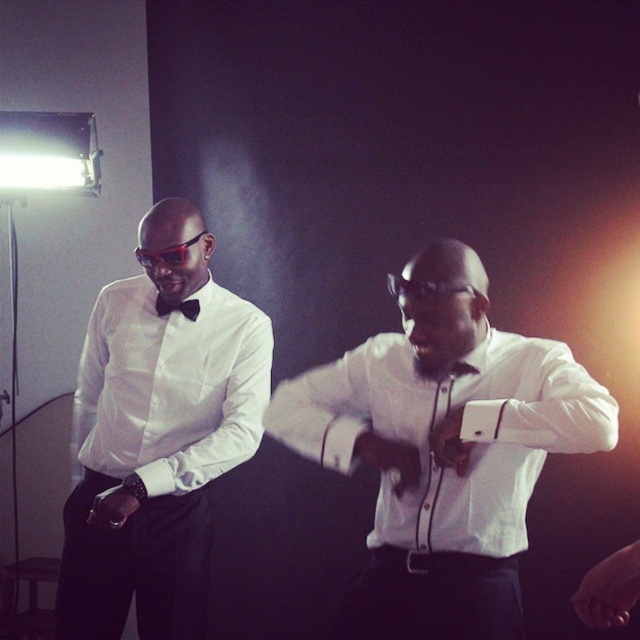
Can you confirm if white satin shirt at center is positioned to the right of white satin shirt at left?

Yes, white satin shirt at center is to the right of white satin shirt at left.

Does white satin shirt at center lie behind white satin shirt at left?

No, white satin shirt at center is in front of white satin shirt at left.

Who is more distant from viewer, (480, 326) or (241, 385)?

The point (241, 385) is more distant.

The image size is (640, 640). I want to click on white satin shirt at center, so click(444, 449).

Can you confirm if white satin shirt at left is positioned above black plastic goggles at left?

No, white satin shirt at left is not above black plastic goggles at left.

Does white satin shirt at left have a smaller size compared to black plastic goggles at left?

No, white satin shirt at left is not smaller than black plastic goggles at left.

Between point (81, 406) and point (186, 253), which one is positioned behind?

The point (81, 406) is more distant.

Where is `white satin shirt at left`? The image size is (640, 640). white satin shirt at left is located at coordinates (172, 387).

Who is positioned more to the right, white satin bow tie at left or black satin bow tie at left?

black satin bow tie at left is more to the right.

Which is more to the left, white satin bow tie at left or black satin bow tie at left?

white satin bow tie at left

This screenshot has height=640, width=640. What do you see at coordinates (156, 449) in the screenshot?
I see `white satin bow tie at left` at bounding box center [156, 449].

The width and height of the screenshot is (640, 640). What are the coordinates of `white satin bow tie at left` in the screenshot? It's located at (156, 449).